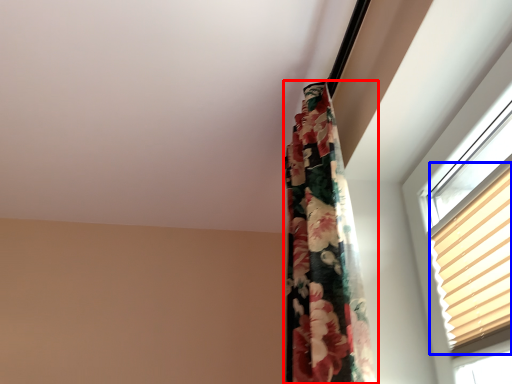
Question: Which object is further to the camera taking this photo, curtain (highlighted by a red box) or blind (highlighted by a blue box)?

Choices:
 (A) curtain
 (B) blind

Answer: (A)